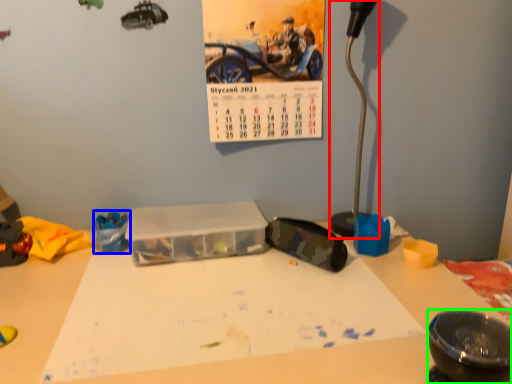
Question: Based on their relative distances, which object is farther from lamp (highlighted by a red box)? Choose from toy (highlighted by a blue box) and bowl (highlighted by a green box).

Choices:
 (A) toy
 (B) bowl

Answer: (A)